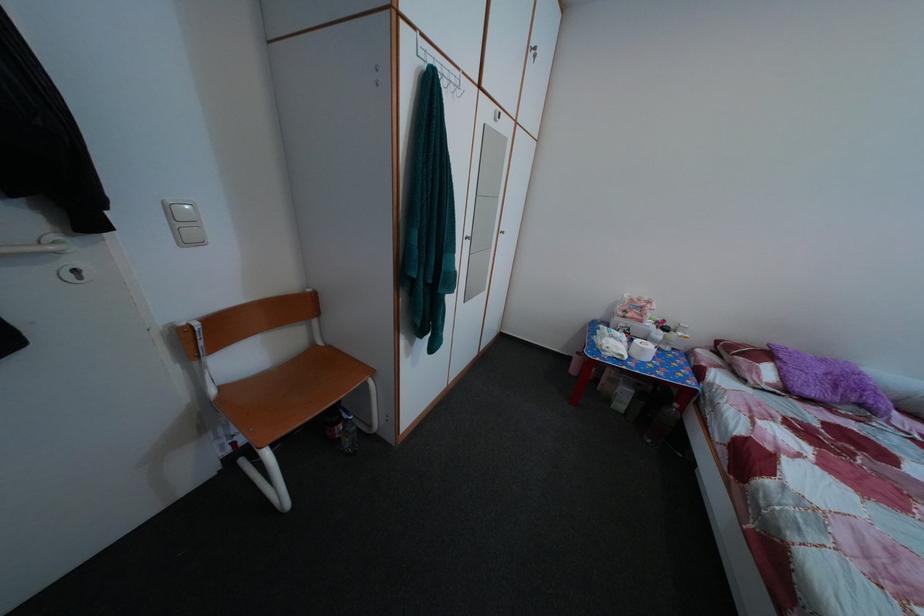
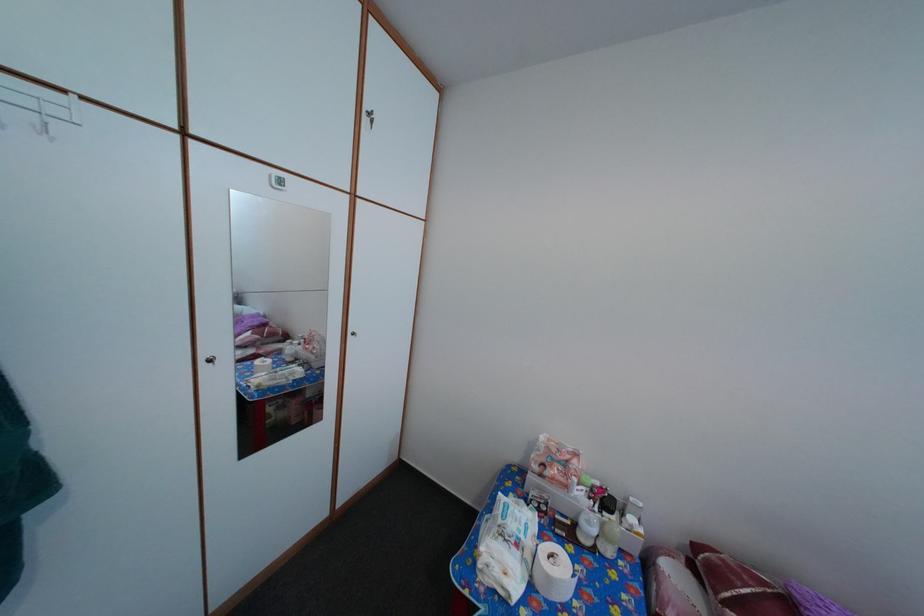
Find the pixel in the second image that matches the point at 652,358 in the first image.

(558, 586)